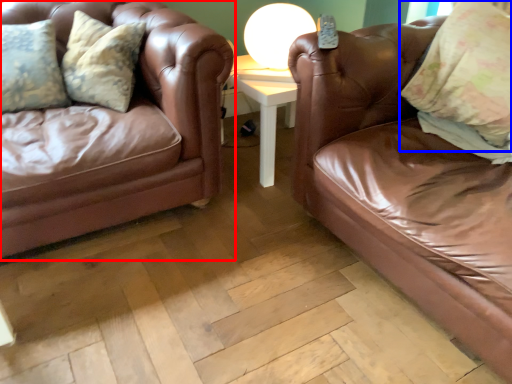
Question: Which object is further to the camera taking this photo, studio couch (highlighted by a red box) or pillow (highlighted by a blue box)?

Choices:
 (A) studio couch
 (B) pillow

Answer: (B)